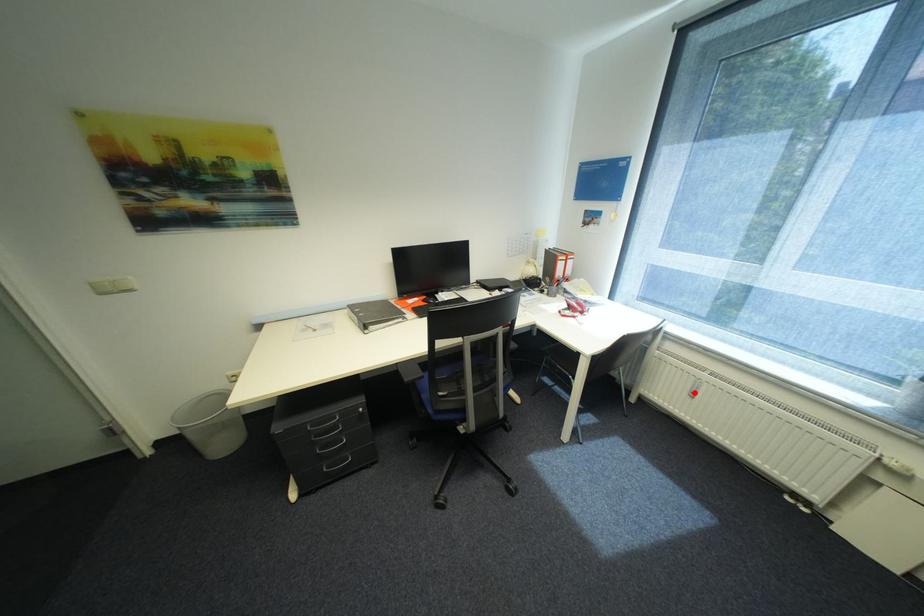
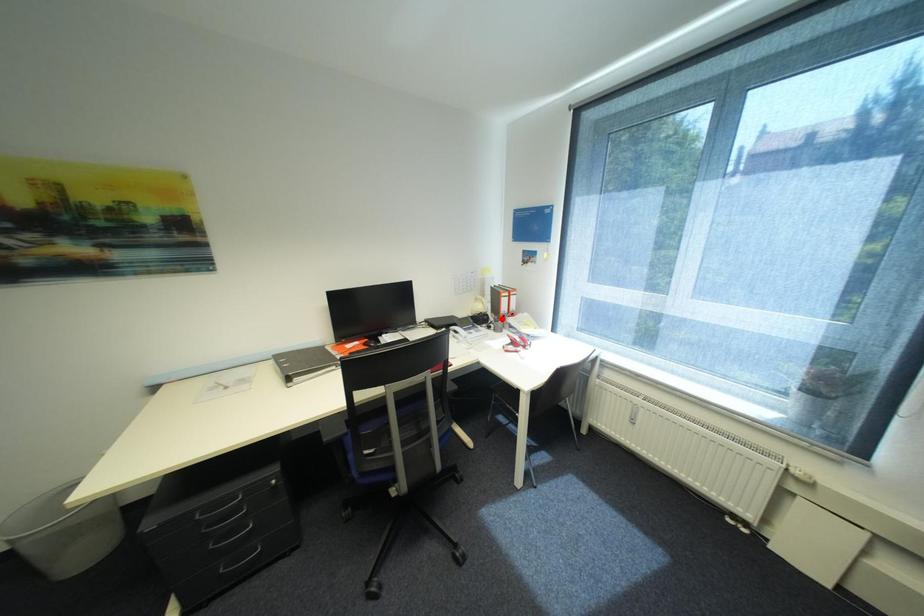
I am providing you with two images of the same scene from different viewpoints. A red point is marked on the first image and another point is marked on the second image. Is the red point in image1 aligned with the point shown in image2?

No